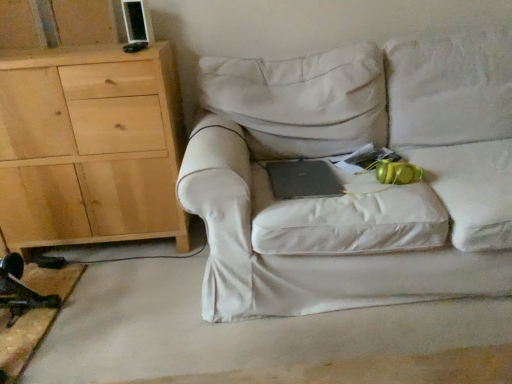
This screenshot has width=512, height=384. I want to click on natural wood cabinet at left, so click(x=90, y=147).

Identify the location of white fabric couch at center. This screenshot has height=384, width=512. [x=361, y=186].

In the image, there is a natural wood cabinet at left. Identify the location of studio couch below it (from a real-world perspective). (361, 186).

Does white fabric couch at center have a greater height compared to natural wood cabinet at left?

No.

Considering the relative sizes of white fabric couch at center and natural wood cabinet at left in the image provided, is white fabric couch at center thinner than natural wood cabinet at left?

No, white fabric couch at center is not thinner than natural wood cabinet at left.

In the scene shown: Is white fabric couch at center positioned behind natural wood cabinet at left?

That is False.

Considering the positions of objects natural wood cabinet at left and white fabric couch at center in the image provided, who is more to the left, natural wood cabinet at left or white fabric couch at center?

From the viewer's perspective, natural wood cabinet at left appears more on the left side.

Can you confirm if natural wood cabinet at left is shorter than white fabric couch at center?

Incorrect, the height of natural wood cabinet at left does not fall short of that of white fabric couch at center.

Is natural wood cabinet at left positioned beyond the bounds of white fabric couch at center?

Yes, natural wood cabinet at left is outside of white fabric couch at center.

In terms of width, does natural wood cabinet at left look wider or thinner when compared to white fabric couch at center?

Considering their sizes, natural wood cabinet at left looks slimmer than white fabric couch at center.

Does natural wood cabinet at left come in front of black matte laptop at center?

That is False.

Which is in front, point (108, 234) or point (309, 170)?

Point (309, 170)

Is natural wood cabinet at left oriented towards black matte laptop at center?

No, natural wood cabinet at left does not turn towards black matte laptop at center.

Considering the sizes of objects natural wood cabinet at left and black matte laptop at center in the image provided, who is smaller, natural wood cabinet at left or black matte laptop at center?

black matte laptop at center is smaller.

In the scene shown: Is white fabric couch at center inside the boundaries of black matte laptop at center, or outside?

white fabric couch at center lies outside black matte laptop at center.

Identify the location of paperback book to the left of white fabric couch at center. This screenshot has width=512, height=384. (303, 179).

Does white fabric couch at center have a larger size compared to black matte laptop at center?

Yes, white fabric couch at center is bigger than black matte laptop at center.

Is white fabric couch at center closer to the viewer compared to black matte laptop at center?

That is True.

Is black matte laptop at center taller or shorter than natural wood cabinet at left?

Considering their sizes, black matte laptop at center has less height than natural wood cabinet at left.

Does black matte laptop at center have a smaller size compared to natural wood cabinet at left?

Indeed, black matte laptop at center has a smaller size compared to natural wood cabinet at left.

From the picture: How different are the orientations of black matte laptop at center and natural wood cabinet at left in degrees?

0.00739 degrees.

Can you confirm if black matte laptop at center is positioned to the left of natural wood cabinet at left?

In fact, black matte laptop at center is to the right of natural wood cabinet at left.

Is point (318, 172) closer to camera compared to point (220, 69)?

Yes.

Based on the photo, what's the angular difference between black matte laptop at center and white fabric couch at center's facing directions?

The angle between the facing direction of black matte laptop at center and the facing direction of white fabric couch at center is 0.413 degrees.

Considering the relative sizes of black matte laptop at center and white fabric couch at center in the image provided, is black matte laptop at center wider than white fabric couch at center?

No, black matte laptop at center is not wider than white fabric couch at center.

Where is `studio couch below the natural wood cabinet at left (from the image's perspective)`? Image resolution: width=512 pixels, height=384 pixels. studio couch below the natural wood cabinet at left (from the image's perspective) is located at coordinates (361, 186).

Identify the location of the chest of drawers that is behind the white fabric couch at center. This screenshot has width=512, height=384. (90, 147).

Looking at the image, which one is located closer to white fabric couch at center, natural wood cabinet at left or black matte laptop at center?

Among the two, black matte laptop at center is located nearer to white fabric couch at center.

From the image, which object appears to be nearer to natural wood cabinet at left, white fabric couch at center or black matte laptop at center?

white fabric couch at center is closer to natural wood cabinet at left.

Estimate the real-world distances between objects in this image. Which object is closer to black matte laptop at center, white fabric couch at center or natural wood cabinet at left?

white fabric couch at center lies closer to black matte laptop at center than the other object.

From the picture: Based on their spatial positions, is black matte laptop at center or white fabric couch at center further from natural wood cabinet at left?

black matte laptop at center is further to natural wood cabinet at left.

Estimate the real-world distances between objects in this image. Which object is closer to black matte laptop at center, natural wood cabinet at left or white fabric couch at center?

white fabric couch at center is positioned closer to the anchor black matte laptop at center.

Considering their positions, is black matte laptop at center positioned further to white fabric couch at center than natural wood cabinet at left?

The object further to white fabric couch at center is natural wood cabinet at left.

Locate an element on the screen. This screenshot has height=384, width=512. paperback book between natural wood cabinet at left and white fabric couch at center in the horizontal direction is located at coordinates (303, 179).